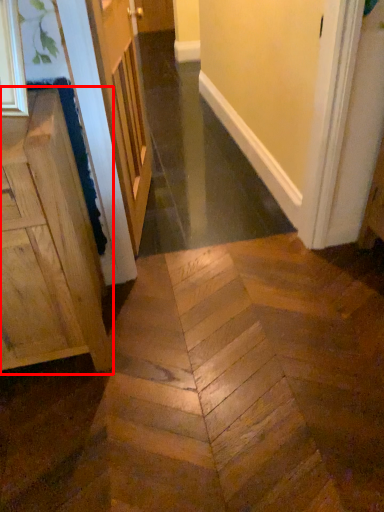
Question: Observing the image, what is the correct spatial positioning of cabinetry (annotated by the red box) in reference to door?

Choices:
 (A) left
 (B) right

Answer: (A)